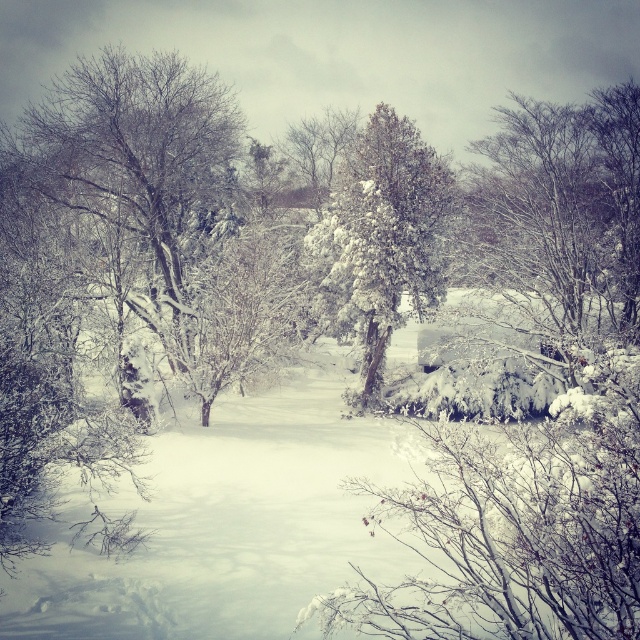
Can you confirm if white snow-covered tree at upper right is positioned to the left of snow-covered evergreen at center?

In fact, white snow-covered tree at upper right is to the right of snow-covered evergreen at center.

Which is in front, point (636, 172) or point (355, 205)?

Point (636, 172) is in front.

In order to click on white snow-covered tree at upper right in this screenshot , I will do `click(564, 209)`.